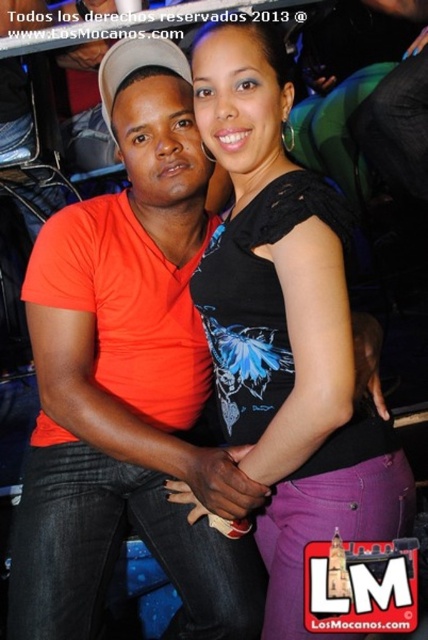
Question: Can you confirm if orange cotton t-shirt at center is positioned below black lace top at center?

Choices:
 (A) yes
 (B) no

Answer: (A)

Question: Is orange cotton t-shirt at center to the right of black lace top at center from the viewer's perspective?

Choices:
 (A) no
 (B) yes

Answer: (A)

Question: Which object appears closest to the camera in this image?

Choices:
 (A) orange cotton t-shirt at center
 (B) black lace top at center

Answer: (B)

Question: Observing the image, what is the correct spatial positioning of orange cotton t-shirt at center in reference to black lace top at center?

Choices:
 (A) above
 (B) below

Answer: (B)